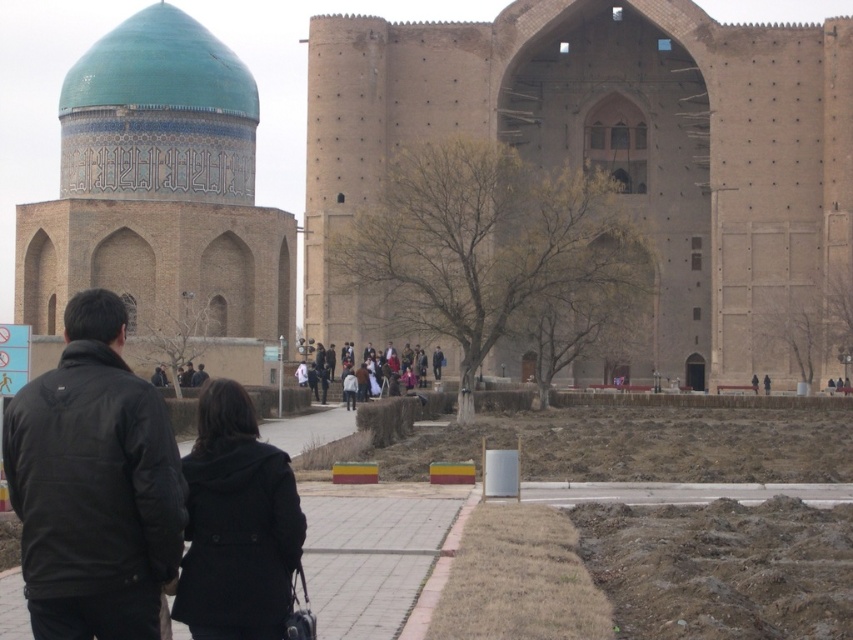
Question: Does black wool coat at center appear on the right side of black matte jacket at center?

Choices:
 (A) no
 (B) yes

Answer: (B)

Question: Is the position of black softshell jacket at lower left less distant than that of black matte jacket at center?

Choices:
 (A) yes
 (B) no

Answer: (A)

Question: Which object is closer to the camera taking this photo?

Choices:
 (A) black softshell jacket at lower left
 (B) black wool coat at center
 (C) black matte jacket at center

Answer: (A)

Question: Among these objects, which one is farthest from the camera?

Choices:
 (A) black wool coat at center
 (B) black softshell jacket at lower left

Answer: (A)

Question: Which point appears closest to the camera in this image?

Choices:
 (A) (196, 365)
 (B) (293, 490)
 (C) (68, 385)

Answer: (C)

Question: Is black softshell jacket at lower left thinner than black wool coat at center?

Choices:
 (A) yes
 (B) no

Answer: (B)